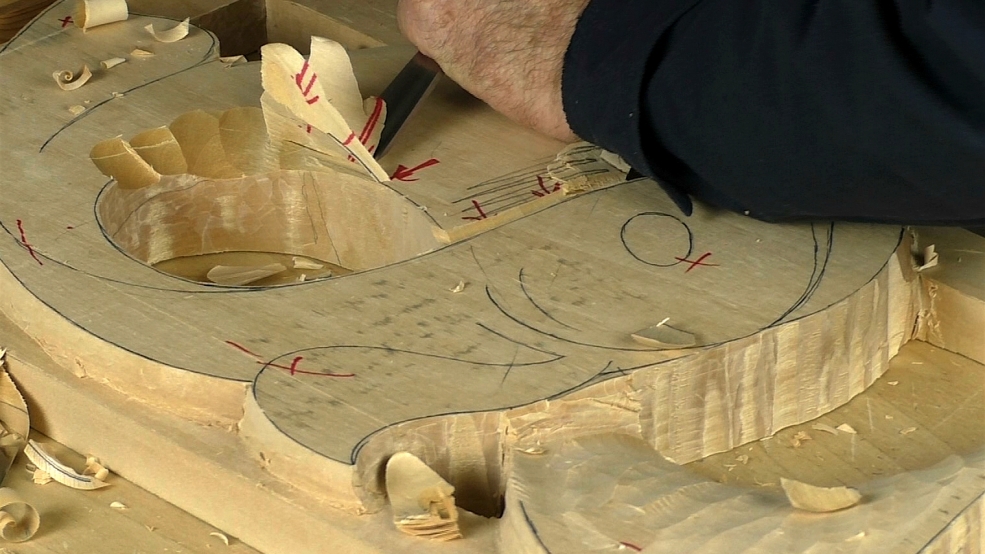
Where is `table that the block of wood sits on`? The image size is (985, 554). table that the block of wood sits on is located at coordinates (122, 527).